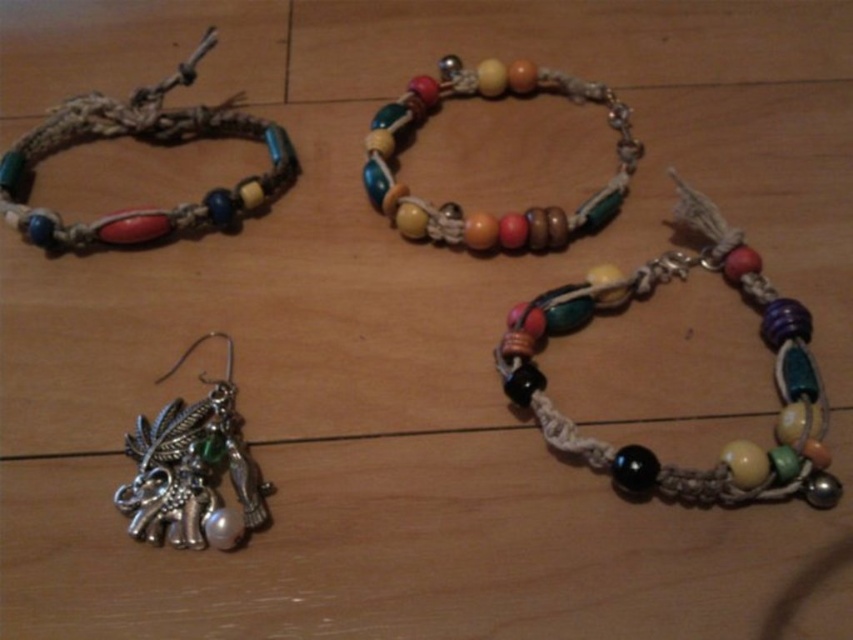
Measure the distance between matte woven bracelet at upper left and wooden beads necklace at upper center.

matte woven bracelet at upper left and wooden beads necklace at upper center are 15.33 inches apart from each other.

Between matte woven bracelet at upper left and wooden beads necklace at upper center, which one appears on the right side from the viewer's perspective?

Positioned to the right is wooden beads necklace at upper center.

Consider the image. Who is more distant from viewer, (x=80, y=100) or (x=486, y=248)?

Positioned behind is point (x=80, y=100).

At what (x,y) coordinates should I click in order to perform the action: click on matte woven bracelet at upper left. Please return your answer as a coordinate pair (x, y). The width and height of the screenshot is (853, 640). Looking at the image, I should click on (148, 140).

Is multicolored beads at center shorter than matte woven bracelet at upper left?

In fact, multicolored beads at center may be taller than matte woven bracelet at upper left.

Locate an element on the screen. This screenshot has height=640, width=853. multicolored beads at center is located at coordinates (732, 442).

Which is behind, point (827, 484) or point (270, 172)?

Point (270, 172)

In order to click on multicolored beads at center in this screenshot , I will do `click(732, 442)`.

Is multicolored beads at center thinner than wooden beads necklace at upper center?

Yes.

Who is lower down, multicolored beads at center or wooden beads necklace at upper center?

multicolored beads at center is lower down.

Between point (573, 328) and point (515, 72), which one is positioned behind?

Point (515, 72)

At what (x,y) coordinates should I click in order to perform the action: click on multicolored beads at center. Please return your answer as a coordinate pair (x, y). The height and width of the screenshot is (640, 853). Looking at the image, I should click on (732, 442).